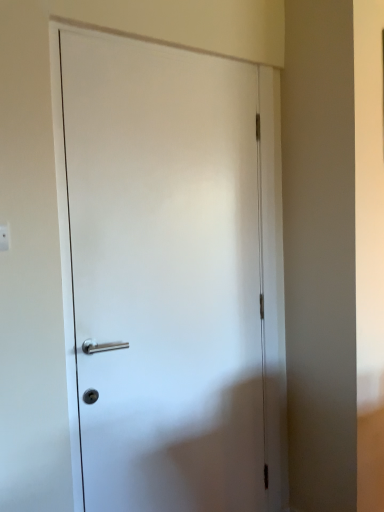
This screenshot has height=512, width=384. Describe the element at coordinates (164, 274) in the screenshot. I see `white matte door at center` at that location.

Find the location of `white matte door at center`. white matte door at center is located at coordinates (164, 274).

Find the location of a particular element. The image size is (384, 512). white matte door at center is located at coordinates (164, 274).